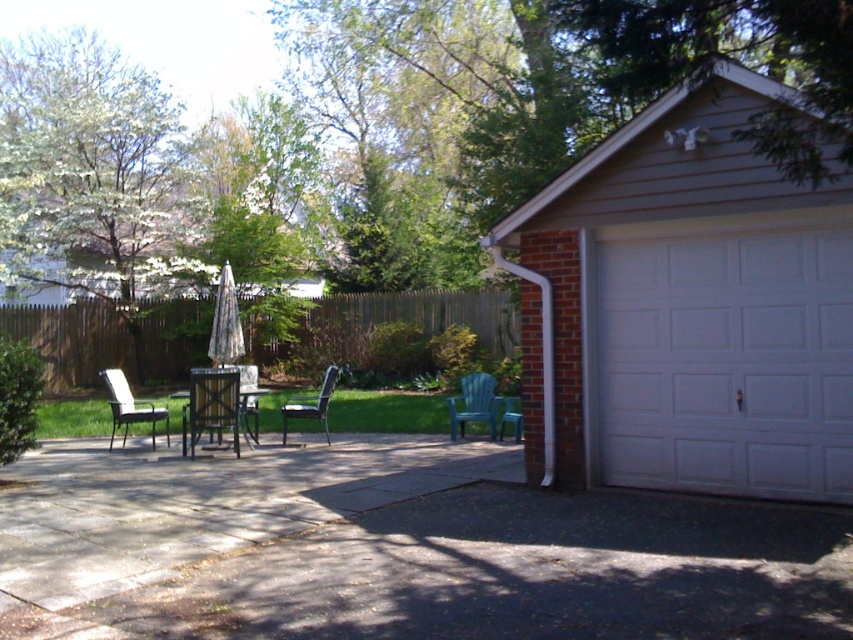
Does white textured garage door at right appear under green plastic chair at center?

Incorrect, white textured garage door at right is not positioned below green plastic chair at center.

Is the position of white textured garage door at right more distant than that of green plastic chair at center?

No, it is in front of green plastic chair at center.

Does point (781, 282) lie behind point (502, 429)?

No, (781, 282) is in front of (502, 429).

Locate an element on the screen. This screenshot has width=853, height=640. white textured garage door at right is located at coordinates (726, 355).

Who is positioned more to the right, wooden chair at center or white plastic chair at left?

wooden chair at center is more to the right.

Locate an element on the screen. wooden chair at center is located at coordinates [212, 404].

Which is behind, point (103, 500) or point (112, 433)?

The point (112, 433) is more distant.

Where is `gray concrete patio at lower left`? The height and width of the screenshot is (640, 853). gray concrete patio at lower left is located at coordinates (201, 502).

Is point (454, 444) positioned after point (161, 412)?

That is False.

You are a GUI agent. You are given a task and a screenshot of the screen. Output one action in this format:
    pyautogui.click(x=<x>, y=<y>)
    Task: Click on the gray concrete patio at lower left
    
    Given the screenshot: What is the action you would take?
    click(x=201, y=502)